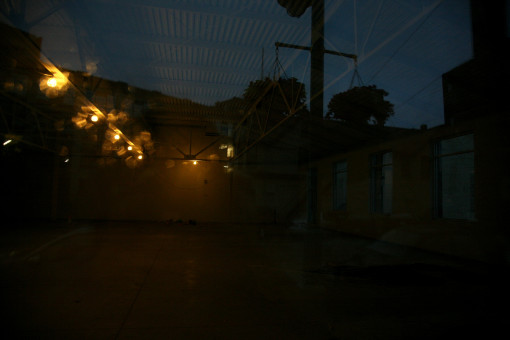
At what (x,y) coordinates should I click in order to perform the action: click on area between white doors. Please return your answer as a coordinate pair (x, y). Looking at the image, I should click on (411, 183).